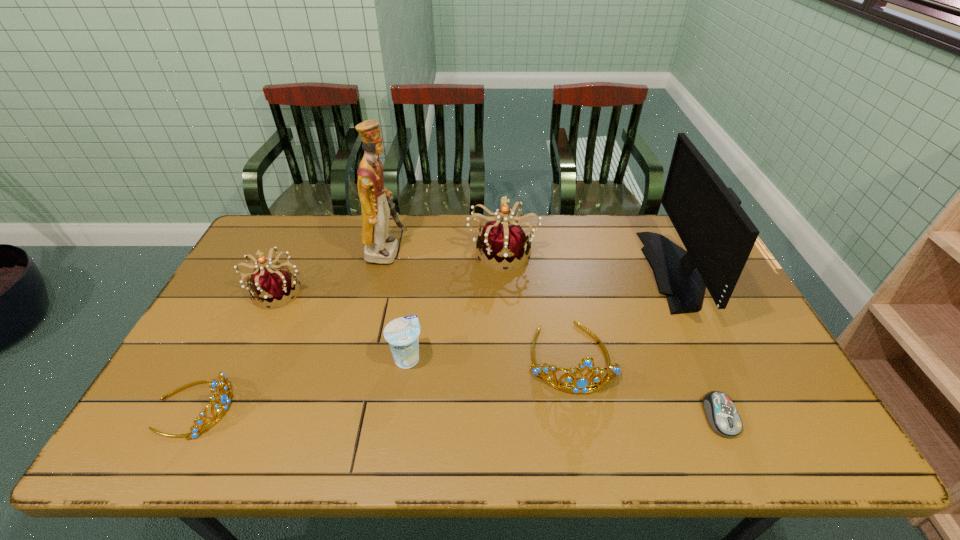
At what (x,y) coordinates should I click in order to perform the action: click on free space between the bigger red tiara and the left gold tiara. Please return your answer as a coordinate pair (x, y). Looking at the image, I should click on (348, 329).

At what (x,y) coordinates should I click in order to perform the action: click on vacant area that lies between the tallest object and the left gold tiara. Please return your answer as a coordinate pair (x, y). The width and height of the screenshot is (960, 540). Looking at the image, I should click on (290, 329).

Where is `free space that is in between the right red tiara and the computer mouse`? The width and height of the screenshot is (960, 540). free space that is in between the right red tiara and the computer mouse is located at coordinates (612, 334).

Locate an element on the screen. Image resolution: width=960 pixels, height=540 pixels. free space between the fifth object from right to left and the nutcracker is located at coordinates (396, 304).

The width and height of the screenshot is (960, 540). I want to click on vacant point located between the shortest object and the bigger gold tiara, so click(x=646, y=387).

The image size is (960, 540). Find the location of `vacant space in between the tallest object and the shortest object`. vacant space in between the tallest object and the shortest object is located at coordinates (553, 334).

Find the location of a particular element. The image size is (960, 540). unoccupied position between the yogurt and the monitor is located at coordinates (545, 314).

Find the location of `free point between the monitor and the shortest object`. free point between the monitor and the shortest object is located at coordinates (702, 343).

Point out which object is positioned as the fourth nearest to the shortest tiara. Please provide its 2D coordinates. Your answer should be formatted as a tuple, i.e. [(x, y)], where the tuple contains the x and y coordinates of a point satisfying the conditions above.

[(503, 243)]

Find the location of a particular element. object that can be found as the second closest to the shortest object is located at coordinates (718, 235).